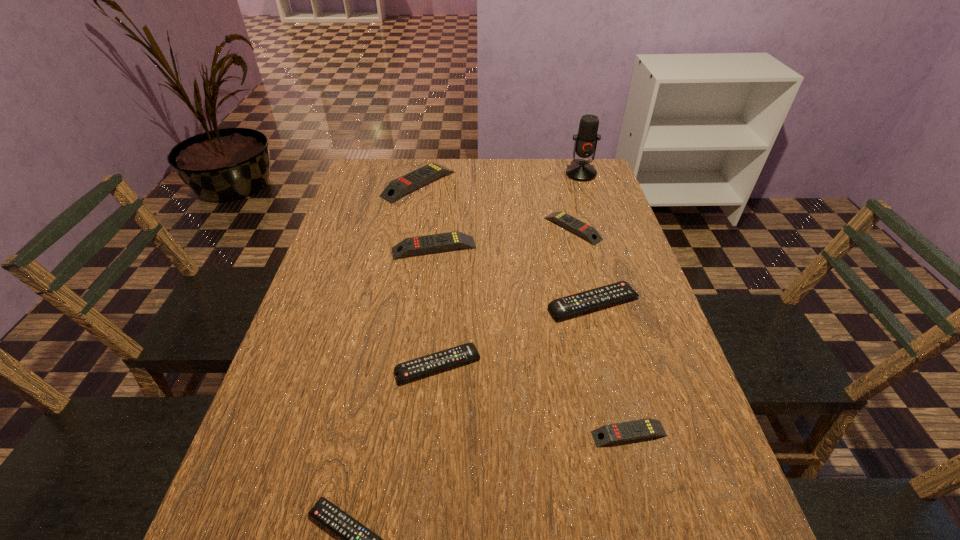
Identify the location of the closest yellow remote control to the nearest remote control. (608, 434).

Identify which yellow remote control is the closest to the second smallest yellow remote control. Please provide its 2D coordinates. Your answer should be formatted as a tuple, i.e. [(x, y)], where the tuple contains the x and y coordinates of a point satisfying the conditions above.

[(452, 240)]

Identify which black remote control is the nearest to the farthest yellow remote control. Please provide its 2D coordinates. Your answer should be formatted as a tuple, i.e. [(x, y)], where the tuple contains the x and y coordinates of a point satisfying the conditions above.

[(588, 300)]

Identify which black remote control is the nearest to the third biggest yellow remote control. Please provide its 2D coordinates. Your answer should be formatted as a tuple, i.e. [(x, y)], where the tuple contains the x and y coordinates of a point satisfying the conditions above.

[(588, 300)]

Locate an element on the screen. The height and width of the screenshot is (540, 960). free region that satisfies the following two spatial constraints: 1. on the back side of the third biggest yellow remote control; 2. on the right side of the sixth shortest object is located at coordinates (437, 228).